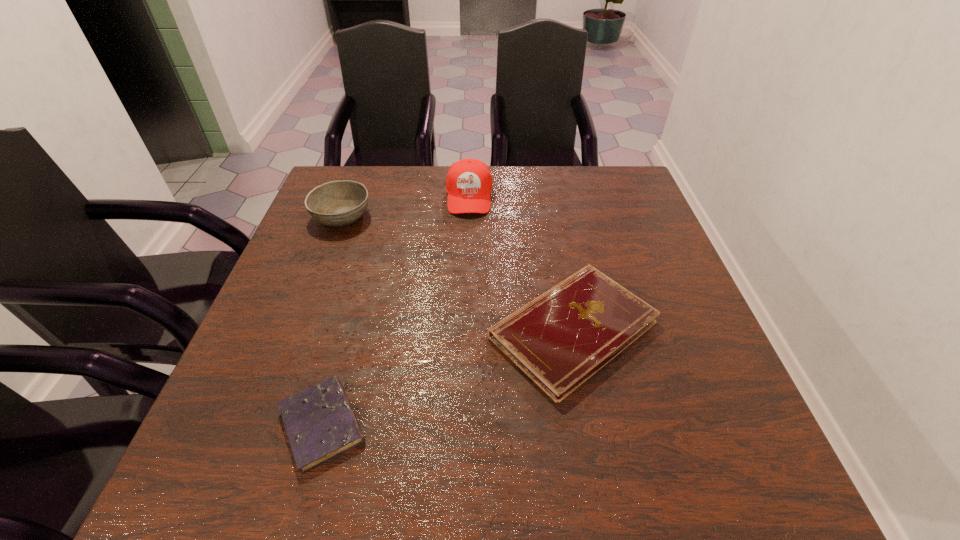
Find the location of a particular element. vacant region at the far left corner is located at coordinates (363, 177).

Identify the location of vacant region at the near left corner of the desktop. The height and width of the screenshot is (540, 960). (x=218, y=474).

Where is `free location at the far right corner`? Image resolution: width=960 pixels, height=540 pixels. free location at the far right corner is located at coordinates (610, 167).

In the image, there is a desktop. Identify the location of vacant space at the near right corner. The width and height of the screenshot is (960, 540). (732, 450).

At what (x,y) coordinates should I click in order to perform the action: click on free point between the third shortest object and the notebook. Please return your answer as a coordinate pair (x, y). This screenshot has height=540, width=960. Looking at the image, I should click on (457, 273).

This screenshot has width=960, height=540. What are the coordinates of `vacant area that lies between the baseball cap and the notebook` in the screenshot? It's located at (521, 263).

Find the location of `vacant area that lies between the baseball cap and the notebook`. vacant area that lies between the baseball cap and the notebook is located at coordinates (521, 263).

At what (x,y) coordinates should I click in order to perform the action: click on vacant area that lies between the notebook and the second tallest object. Please return your answer as a coordinate pair (x, y). Looking at the image, I should click on (457, 273).

Image resolution: width=960 pixels, height=540 pixels. In order to click on free space that is in between the baseball cap and the notebook in this screenshot , I will do `click(521, 263)`.

Where is `free spot between the baseball cap and the notebook`? free spot between the baseball cap and the notebook is located at coordinates (521, 263).